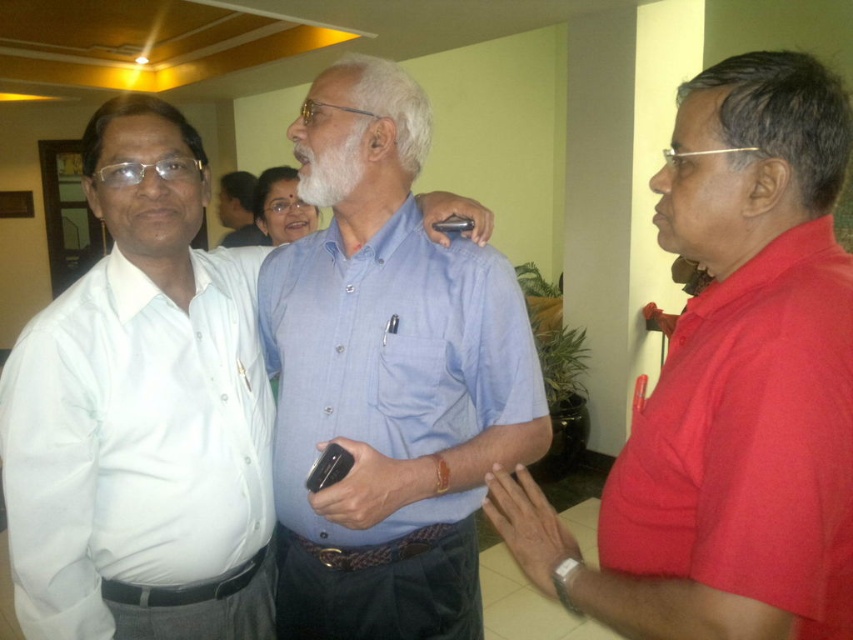
Based on the photo, can you confirm if red matte shirt at right is positioned above whitehairbeard at center?

No.

Who is more distant from viewer, (840, 464) or (318, 170)?

Positioned behind is point (318, 170).

The width and height of the screenshot is (853, 640). Find the location of `red matte shirt at right`. red matte shirt at right is located at coordinates (730, 387).

Can you confirm if matte blue shirt at center is smaller than whitehairbeard at center?

No.

Can you confirm if matte blue shirt at center is bigger than whitehairbeard at center?

Indeed, matte blue shirt at center has a larger size compared to whitehairbeard at center.

Is point (219, 497) positioned behind point (305, 156)?

No, it is not.

Where is `matte blue shirt at center`? matte blue shirt at center is located at coordinates (142, 413).

Is matte blue shirt at center above white cotton shirt at left?

Yes.

Who is taller, matte blue shirt at center or white cotton shirt at left?

matte blue shirt at center

Is point (70, 403) closer to camera compared to point (79, 337)?

That is True.

This screenshot has width=853, height=640. In order to click on matte blue shirt at center in this screenshot , I will do `click(142, 413)`.